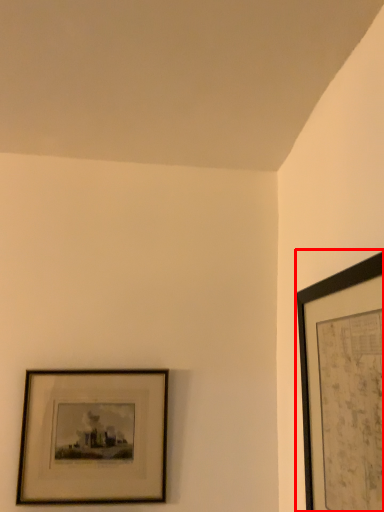
Question: From the image's perspective, what is the correct spatial positioning of picture frame (annotated by the red box) in reference to picture frame?

Choices:
 (A) below
 (B) above

Answer: (B)